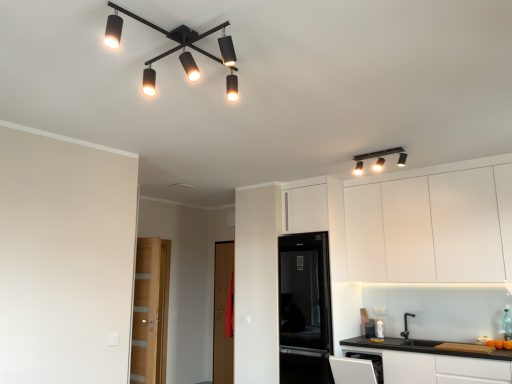
Question: Is white matte cabinet at lower right, the 2th cabinetry from the top, positioned before black glass refrigerator at center?

Choices:
 (A) no
 (B) yes

Answer: (B)

Question: Is white matte cabinet at lower right, the 2th cabinetry from the top, not inside black glass refrigerator at center?

Choices:
 (A) no
 (B) yes

Answer: (B)

Question: From a real-world perspective, is white matte cabinet at lower right, arranged as the 1th cabinetry when ordered from the bottom, beneath black glass refrigerator at center?

Choices:
 (A) yes
 (B) no

Answer: (A)

Question: Is black glass refrigerator at center located within white matte cabinet at lower right, the 2th cabinetry from the top?

Choices:
 (A) no
 (B) yes

Answer: (A)

Question: From the image's perspective, is white matte cabinet at lower right, arranged as the 1th cabinetry when ordered from the bottom, beneath black glass refrigerator at center?

Choices:
 (A) yes
 (B) no

Answer: (A)

Question: Is white matte cabinet at lower right, the 2th cabinetry from the top, facing towards black glass refrigerator at center?

Choices:
 (A) yes
 (B) no

Answer: (B)

Question: Considering the relative sizes of brown wooden door at center and light brown wooden door at left in the image provided, is brown wooden door at center thinner than light brown wooden door at left?

Choices:
 (A) no
 (B) yes

Answer: (B)

Question: Is brown wooden door at center touching light brown wooden door at left?

Choices:
 (A) yes
 (B) no

Answer: (B)

Question: From the image's perspective, is brown wooden door at center above light brown wooden door at left?

Choices:
 (A) yes
 (B) no

Answer: (B)

Question: Does brown wooden door at center appear on the left side of light brown wooden door at left?

Choices:
 (A) yes
 (B) no

Answer: (B)

Question: Can you confirm if brown wooden door at center is shorter than light brown wooden door at left?

Choices:
 (A) yes
 (B) no

Answer: (B)

Question: Is brown wooden door at center positioned in front of light brown wooden door at left?

Choices:
 (A) no
 (B) yes

Answer: (A)

Question: Does brown wooden door at center come in front of white matte cabinet at upper right, which ranks as the first cabinetry in top-to-bottom order?

Choices:
 (A) no
 (B) yes

Answer: (A)